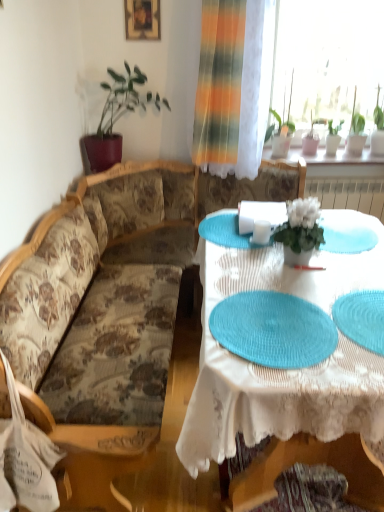
At what (x,y) coordinates should I click in order to perform the action: click on free area in between teal woven placemat at center and blue woven placemat at lower right. Please return your answer as a coordinate pair (x, y). Image resolution: width=384 pixels, height=512 pixels. Looking at the image, I should click on (326, 309).